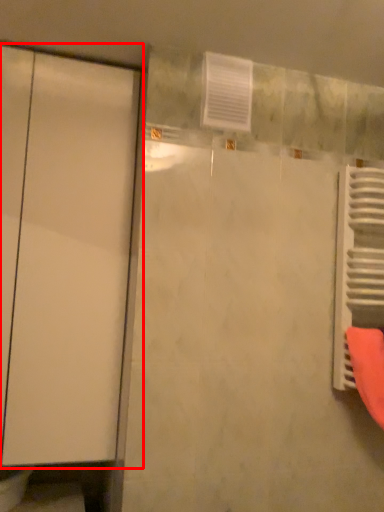
Question: From the image's perspective, what is the correct spatial relationship of door (annotated by the red box) in relation to radiator?

Choices:
 (A) below
 (B) above

Answer: (B)